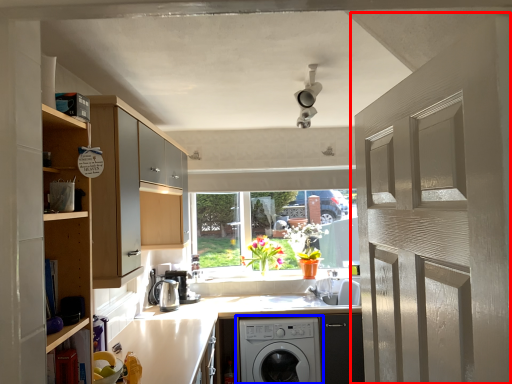
Question: Which object is closer to the camera taking this photo, door (highlighted by a red box) or washing machine (highlighted by a blue box)?

Choices:
 (A) door
 (B) washing machine

Answer: (A)